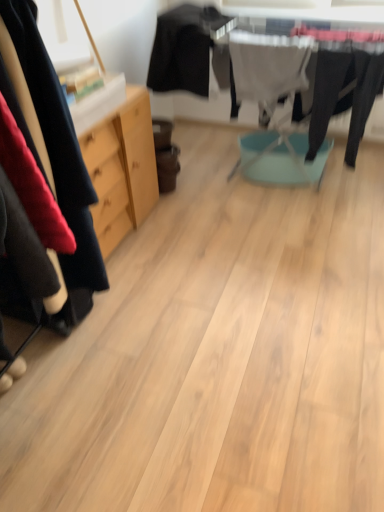
Describe the element at coordinates (183, 49) in the screenshot. I see `black fabric at upper center, the second clothing positioned from the right` at that location.

Locate an element on the screen. black fabric at upper center, placed as the first clothing when sorted from left to right is located at coordinates (x=183, y=49).

You are a GUI agent. You are given a task and a screenshot of the screen. Output one action in this format:
    pyautogui.click(x=<x>, y=<y>)
    Task: Click on the white fabric at center, the first clothing when ordered from right to left
    This screenshot has width=384, height=512.
    Given the screenshot: What is the action you would take?
    pyautogui.click(x=266, y=70)

Measure the distance between point (284, 76) and camera.

Point (284, 76) is 7.55 feet away from camera.

Image resolution: width=384 pixels, height=512 pixels. Describe the element at coordinates (266, 70) in the screenshot. I see `white fabric at center, the first clothing when ordered from right to left` at that location.

The image size is (384, 512). I want to click on black fabric at upper center, the second clothing positioned from the right, so click(x=183, y=49).

Between white fabric at center, arranged as the second clothing when viewed from the left, and black fabric at upper center, placed as the first clothing when sorted from left to right, which one appears on the right side from the viewer's perspective?

white fabric at center, arranged as the second clothing when viewed from the left, is more to the right.

Considering the positions of objects white fabric at center, the first clothing when ordered from right to left, and black fabric at upper center, placed as the first clothing when sorted from left to right, in the image provided, who is behind, white fabric at center, the first clothing when ordered from right to left, or black fabric at upper center, placed as the first clothing when sorted from left to right,?

black fabric at upper center, placed as the first clothing when sorted from left to right, is behind.

In the scene shown: Which is nearer, (261, 102) or (201, 60)?

Point (201, 60)

From the image's perspective, would you say white fabric at center, arranged as the second clothing when viewed from the left, is positioned over black fabric at upper center, placed as the first clothing when sorted from left to right?

No, from the image's perspective, white fabric at center, arranged as the second clothing when viewed from the left, is not on top of black fabric at upper center, placed as the first clothing when sorted from left to right.

From a real-world perspective, between white fabric at center, the first clothing when ordered from right to left, and black fabric at upper center, the second clothing positioned from the right, who is vertically lower?

white fabric at center, the first clothing when ordered from right to left.

Looking at their sizes, would you say white fabric at center, the first clothing when ordered from right to left, is wider or thinner than black fabric at upper center, placed as the first clothing when sorted from left to right?

Clearly, white fabric at center, the first clothing when ordered from right to left, has less width compared to black fabric at upper center, placed as the first clothing when sorted from left to right.

Between white fabric at center, arranged as the second clothing when viewed from the left, and black fabric at upper center, placed as the first clothing when sorted from left to right, which one has less height?

With less height is black fabric at upper center, placed as the first clothing when sorted from left to right.

Which of these two, white fabric at center, arranged as the second clothing when viewed from the left, or black fabric at upper center, placed as the first clothing when sorted from left to right, is smaller?

With smaller size is white fabric at center, arranged as the second clothing when viewed from the left.

Choose the correct answer: Is white fabric at center, the first clothing when ordered from right to left, inside black fabric at upper center, the second clothing positioned from the right, or outside it?

white fabric at center, the first clothing when ordered from right to left, is spatially situated outside black fabric at upper center, the second clothing positioned from the right.

Is white fabric at center, the first clothing when ordered from right to left, positioned far away from black fabric at upper center, the second clothing positioned from the right?

No.

Consider the image. Is white fabric at center, arranged as the second clothing when viewed from the left, looking in the opposite direction of black fabric at upper center, placed as the first clothing when sorted from left to right?

No, white fabric at center, arranged as the second clothing when viewed from the left, is not facing away from black fabric at upper center, placed as the first clothing when sorted from left to right.

Image resolution: width=384 pixels, height=512 pixels. In order to click on clothing on the left side of white fabric at center, the first clothing when ordered from right to left in this screenshot , I will do `click(183, 49)`.

Based on the photo, considering the positions of objects black fabric at upper center, placed as the first clothing when sorted from left to right, and white fabric at center, arranged as the second clothing when viewed from the left, in the image provided, who is more to the right, black fabric at upper center, placed as the first clothing when sorted from left to right, or white fabric at center, arranged as the second clothing when viewed from the left,?

white fabric at center, arranged as the second clothing when viewed from the left, is more to the right.

In the image, is black fabric at upper center, placed as the first clothing when sorted from left to right, positioned in front of or behind white fabric at center, the first clothing when ordered from right to left?

In the image, black fabric at upper center, placed as the first clothing when sorted from left to right, appears behind white fabric at center, the first clothing when ordered from right to left.

Which point is more distant from viewer, [185,42] or [259,104]?

The point [259,104] is farther.

From the image's perspective, is black fabric at upper center, placed as the first clothing when sorted from left to right, above or below white fabric at center, arranged as the second clothing when viewed from the left?

Based on their image positions, black fabric at upper center, placed as the first clothing when sorted from left to right, is located above white fabric at center, arranged as the second clothing when viewed from the left.

From a real-world perspective, which object stands above the other?

black fabric at upper center, the second clothing positioned from the right.

Which of these two, black fabric at upper center, the second clothing positioned from the right, or white fabric at center, arranged as the second clothing when viewed from the left, is thinner?

Thinner between the two is white fabric at center, arranged as the second clothing when viewed from the left.

Is black fabric at upper center, placed as the first clothing when sorted from left to right, taller or shorter than white fabric at center, the first clothing when ordered from right to left?

black fabric at upper center, placed as the first clothing when sorted from left to right, is shorter than white fabric at center, the first clothing when ordered from right to left.

Is black fabric at upper center, placed as the first clothing when sorted from left to right, bigger or smaller than white fabric at center, the first clothing when ordered from right to left?

black fabric at upper center, placed as the first clothing when sorted from left to right, is bigger than white fabric at center, the first clothing when ordered from right to left.

Can white fabric at center, arranged as the second clothing when viewed from the left, be found inside black fabric at upper center, the second clothing positioned from the right?

No, white fabric at center, arranged as the second clothing when viewed from the left, is not inside black fabric at upper center, the second clothing positioned from the right.

Does black fabric at upper center, the second clothing positioned from the right, touch white fabric at center, arranged as the second clothing when viewed from the left?

No, black fabric at upper center, the second clothing positioned from the right, is not touching white fabric at center, arranged as the second clothing when viewed from the left.

Is black fabric at upper center, the second clothing positioned from the right, facing away from white fabric at center, the first clothing when ordered from right to left?

black fabric at upper center, the second clothing positioned from the right, is not turned away from white fabric at center, the first clothing when ordered from right to left.

How different are the orientations of black fabric at upper center, the second clothing positioned from the right, and white fabric at center, the first clothing when ordered from right to left, in degrees?

They differ by 5.13e-05 degrees in their facing directions.

I want to click on clothing above the white fabric at center, the first clothing when ordered from right to left (from the image's perspective), so click(183, 49).

You are a GUI agent. You are given a task and a screenshot of the screen. Output one action in this format:
    pyautogui.click(x=<x>, y=<y>)
    Task: Click on the clothing below the black fabric at upper center, the second clothing positioned from the right (from the image's perspective)
    
    Given the screenshot: What is the action you would take?
    pyautogui.click(x=266, y=70)

This screenshot has width=384, height=512. What are the coordinates of `clothing above the white fabric at center, the first clothing when ordered from right to left (from the image's perspective)` in the screenshot? It's located at (183, 49).